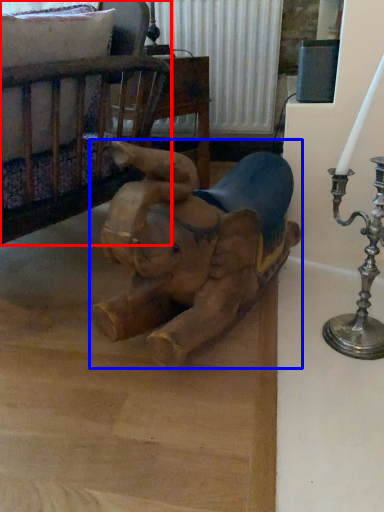
Question: Among these objects, which one is farthest to the camera, furniture (highlighted by a red box) or toy (highlighted by a blue box)?

Choices:
 (A) furniture
 (B) toy

Answer: (A)